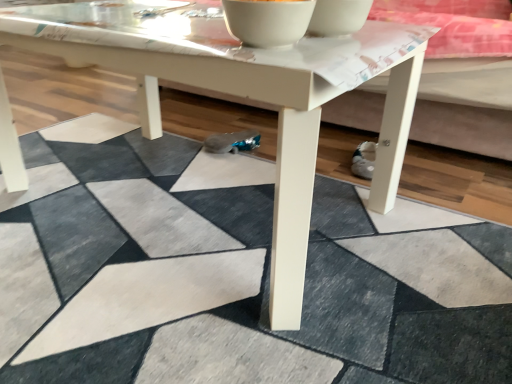
Question: Visually, is white glossy bowl at upper center, the first bowl in the right-to-left sequence, positioned to the left or to the right of white matte coffee table at center?

Choices:
 (A) left
 (B) right

Answer: (B)

Question: Is white glossy bowl at upper center, which ranks as the 2th bowl in left-to-right order, wider or thinner than white matte coffee table at center?

Choices:
 (A) wide
 (B) thin

Answer: (B)

Question: Which object is the closest to the white glossy bowl at upper center, which ranks as the 2th bowl in left-to-right order?

Choices:
 (A) white glossy bowl at upper center, acting as the second bowl starting from the right
 (B) white matte coffee table at center

Answer: (A)

Question: Based on their relative distances, which object is farther from the white glossy bowl at upper center, the first bowl from the left?

Choices:
 (A) white matte coffee table at center
 (B) white glossy bowl at upper center, which ranks as the 2th bowl in left-to-right order

Answer: (A)